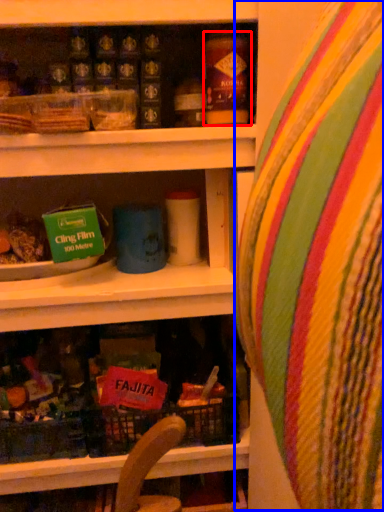
Question: Which object is further to the camera taking this photo, yoghurt (highlighted by a red box) or bean bag chair (highlighted by a blue box)?

Choices:
 (A) yoghurt
 (B) bean bag chair

Answer: (A)